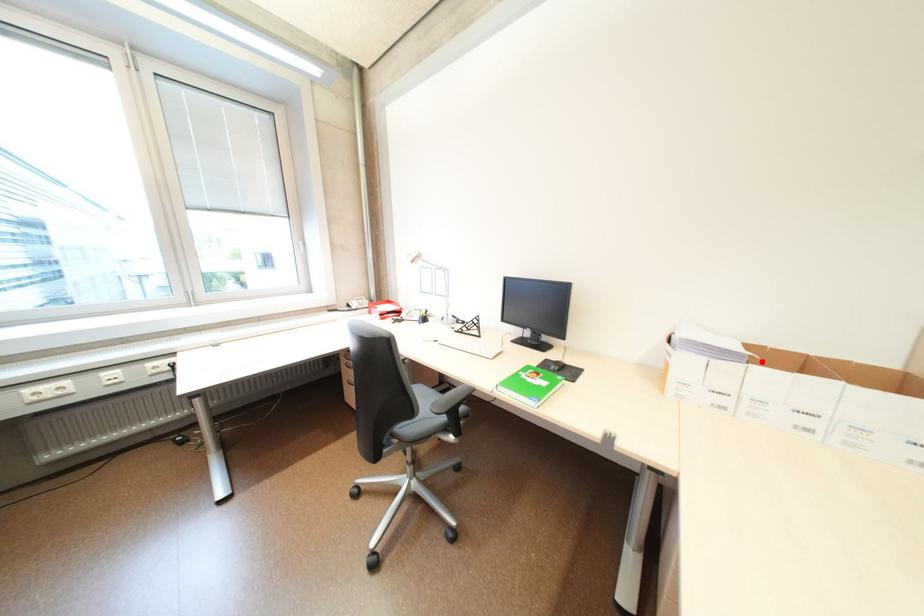
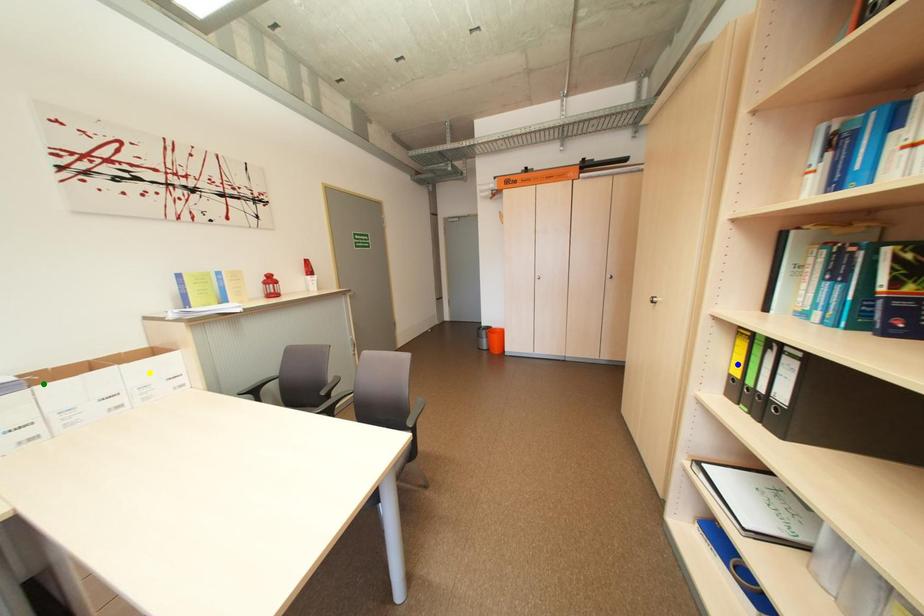
Question: I am providing you with two images of the same scene from different viewpoints. A red point is marked on the first image. You are given multiple points on the second image. In image 2, which mark is for the same physical point as the one in image 1?

Choices:
 (A) green point
 (B) yellow point
 (C) blue point

Answer: (A)